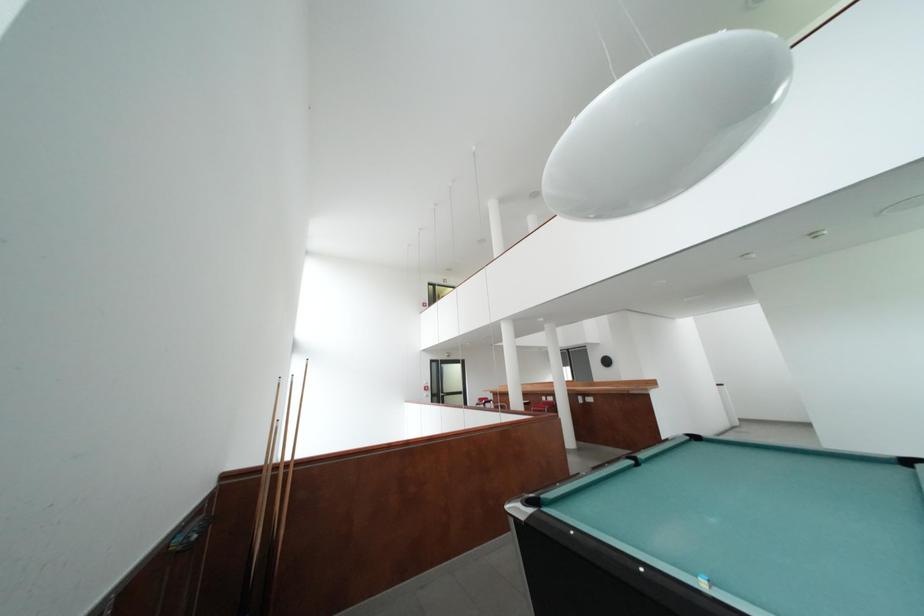
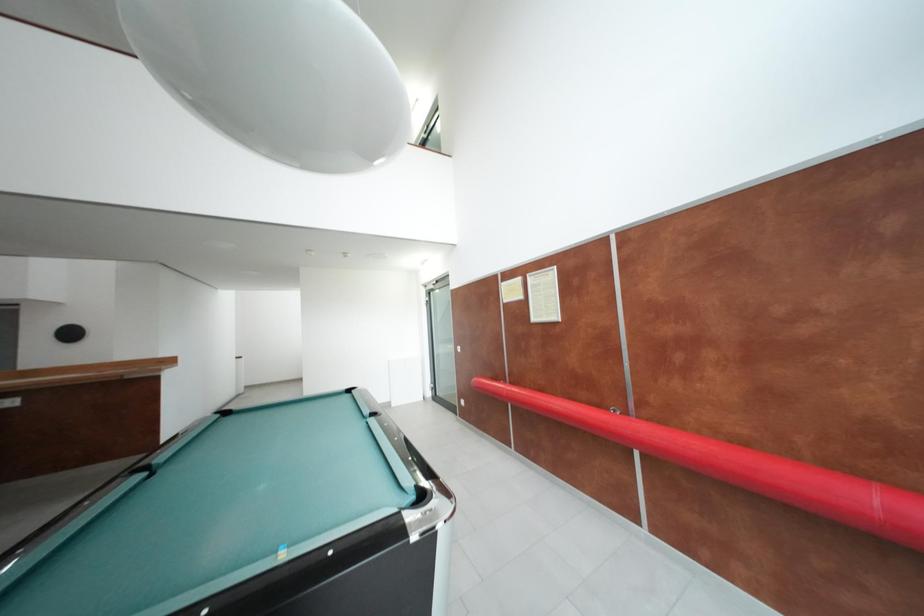
Question: How did the camera likely rotate?

Choices:
 (A) Left
 (B) Right
 (C) Up
 (D) Down

Answer: (B)